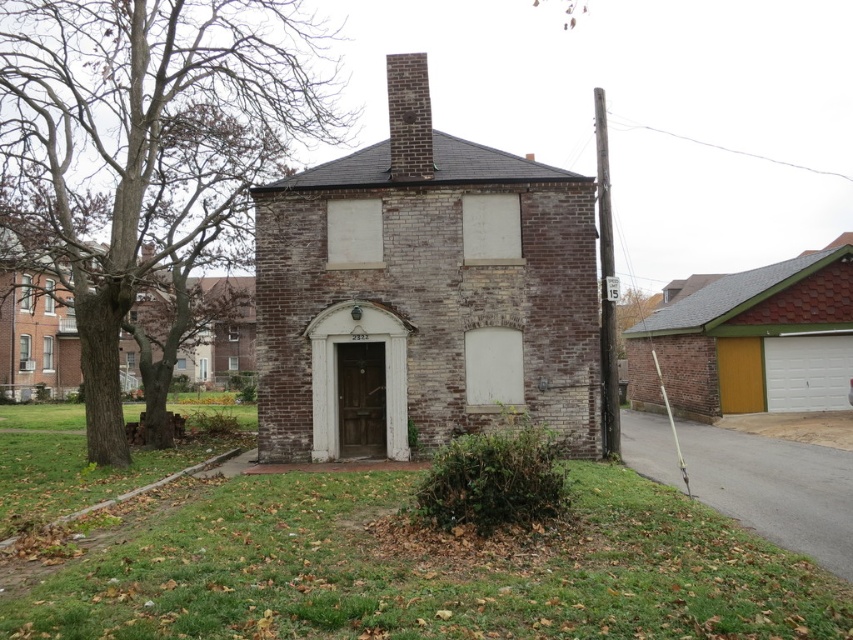
Which of these two, yellow wood garage at right or wooden door at center, stands taller?

yellow wood garage at right

How much distance is there between yellow wood garage at right and wooden door at center?

yellow wood garage at right is 42.75 feet away from wooden door at center.

Identify the location of yellow wood garage at right. (747, 340).